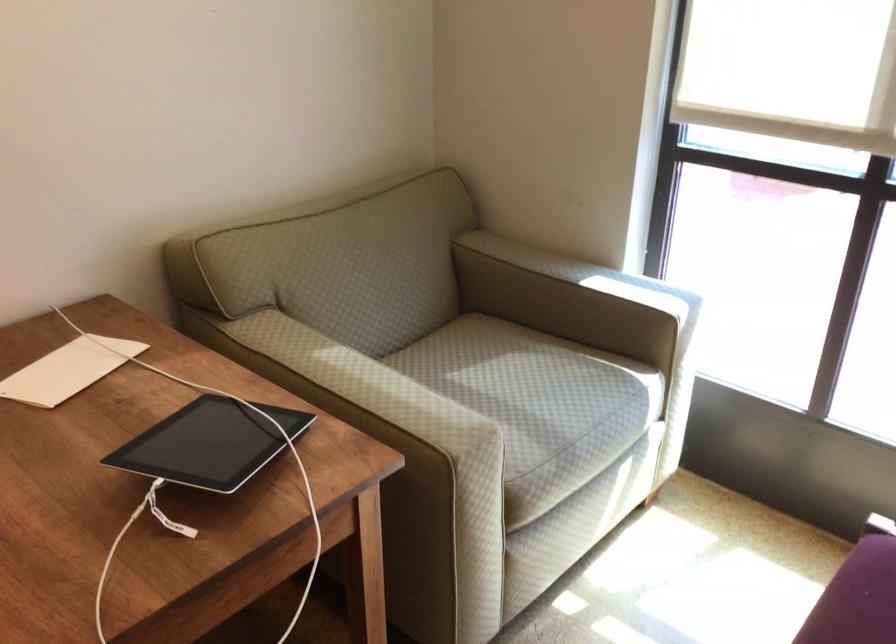
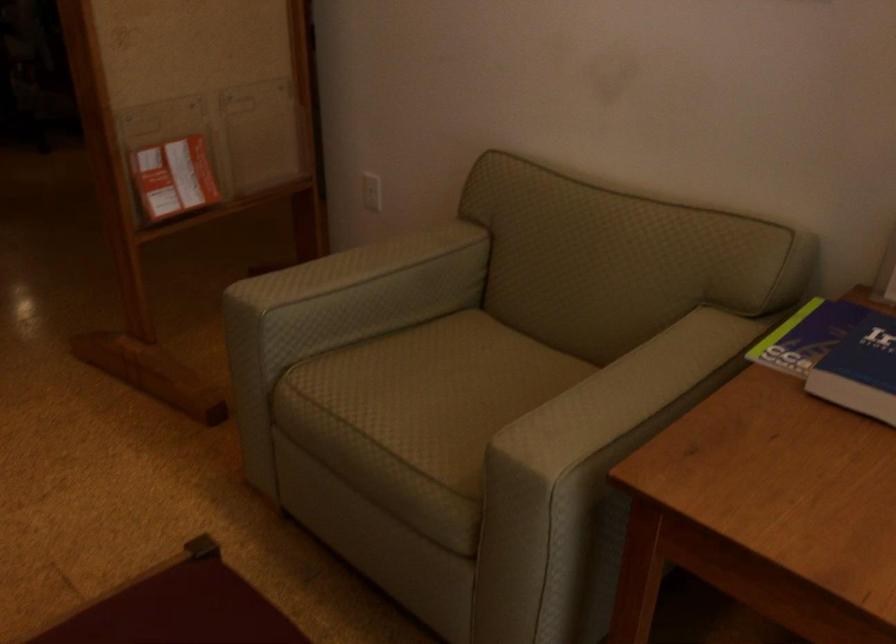
First-person continuous shooting, in which direction is the camera rotating?

The camera rotated toward left-down.